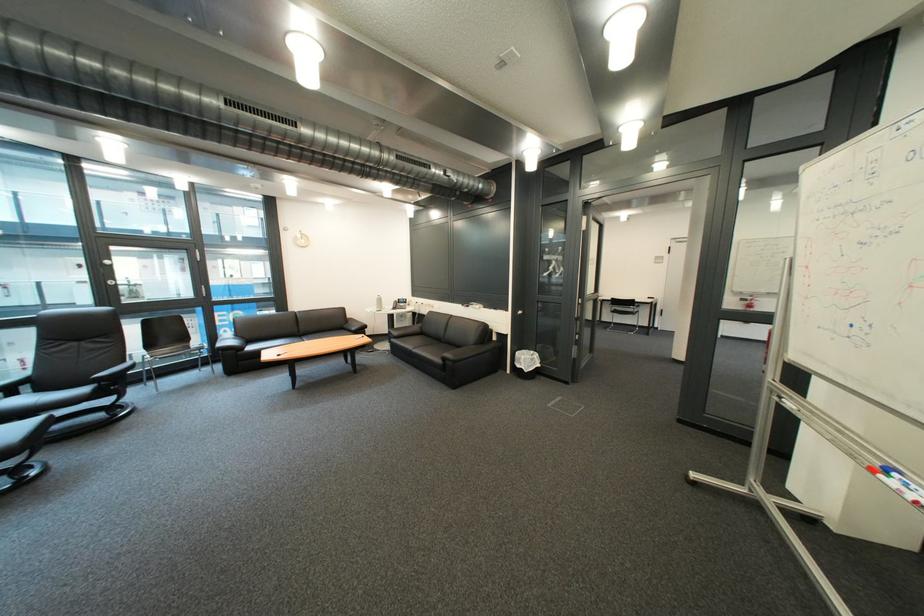
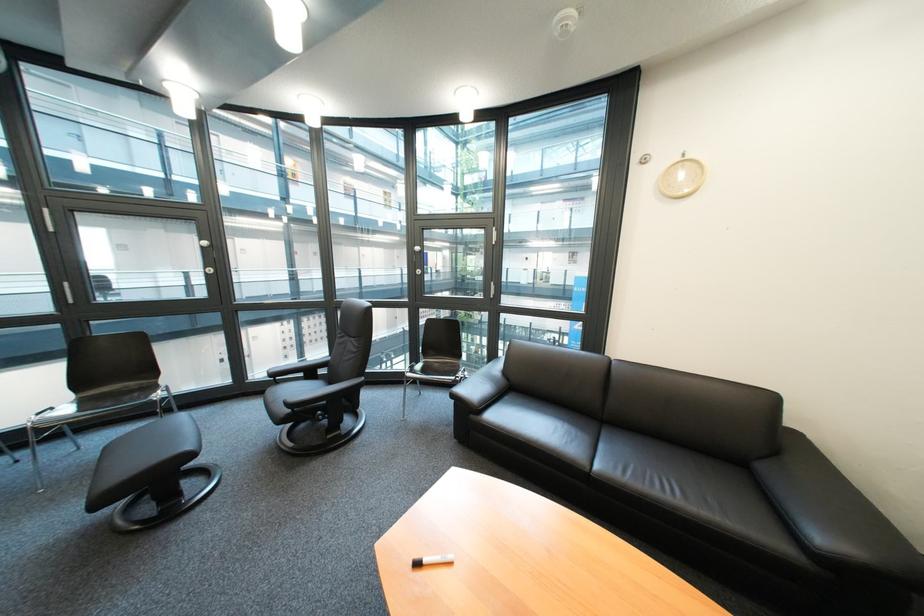
Where in the second image is the point corresponding to point 253,354 from the first image?

(485, 418)